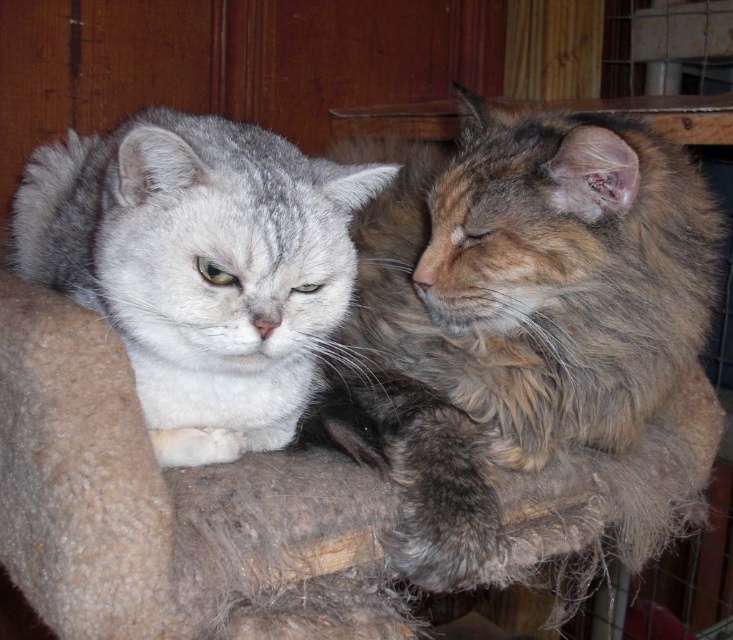
You are a cat owner who wants to buy a new cat bed that fits both cats. The bed must be wider than the combined width of the fluffy brown cat at right and the gray fur cat at left. What should you consider when choosing the bed?

The fluffy brown cat at right is wider than the gray fur cat at left. To ensure the bed is wide enough, you should select a bed that is wider than the sum of both their widths, taking into account the larger width of the fluffy brown cat at right.

You are a cat owner who wants to buy a new cat bed that fits both of your cats. The bed you found has a length of 50 cm. Given the sizes of the fluffy brown cat at right and the gray fur cat at left, do you think the bed will be big enough for both of them to lie down comfortably side by side?

The fluffy brown cat at right is larger than the gray fur cat at left. To determine if the bed is sufficient, we need to know their combined length. However, the provided information only states the size comparison between them, not their exact measurements. Without specific dimensions, it is uncertain if the 50 cm bed will accommodate both cats comfortably.

You are a cat owner who wants to ensure both cats are within a safe distance of each other for mutual comfort. Given that the recommended safe distance between two cats is 4 feet, can you determine if the fluffy brown cat at right and the other cat are within the recommended distance?

The distance between the fluffy brown cat at right and the other cat is 4.59 feet, which is slightly more than the recommended 4 feet. Therefore, they are just outside the recommended safe distance for mutual comfort.